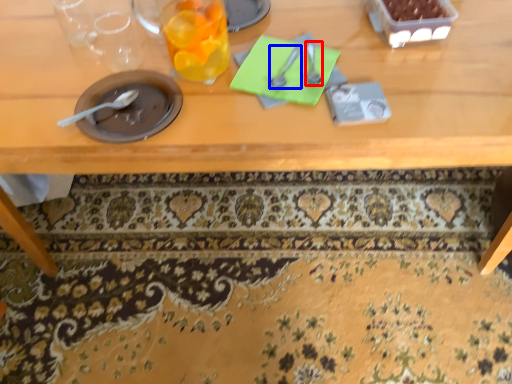
Question: Which point is further to the camera, tableware (highlighted by a red box) or tableware (highlighted by a blue box)?

Choices:
 (A) tableware
 (B) tableware

Answer: (A)